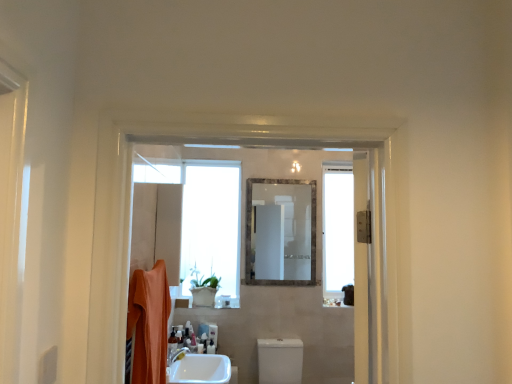
Where is `white glossy toilet at center`? The image size is (512, 384). white glossy toilet at center is located at coordinates (280, 360).

What is the approximate width of orange cotton bath towel at left?

The width of orange cotton bath towel at left is 4.02 inches.

Where is `translucent plastic bottle at lower center, placed as the 1th toiletry when sorted from top to bottom`? This screenshot has height=384, width=512. translucent plastic bottle at lower center, placed as the 1th toiletry when sorted from top to bottom is located at coordinates (172, 343).

This screenshot has height=384, width=512. What do you see at coordinates (176, 355) in the screenshot? I see `white glossy tap at lower center` at bounding box center [176, 355].

Image resolution: width=512 pixels, height=384 pixels. Describe the element at coordinates (281, 232) in the screenshot. I see `silver metallic mirror at center` at that location.

This screenshot has width=512, height=384. I want to click on translucent plastic soap dispenser at lower center, placed as the 1th toiletry when sorted from back to front, so click(211, 347).

Identify the location of transparent glass window at right. Image resolution: width=512 pixels, height=384 pixels. (338, 229).

Does translucent plastic soap dispenser at lower center, acting as the first toiletry starting from the right, have a greater height compared to orange cotton bath towel at left?

No.

What's the angular difference between translucent plastic soap dispenser at lower center, placed as the 1th toiletry when sorted from back to front, and orange cotton bath towel at left's facing directions?

There is a 91.3-degree angle between the facing directions of translucent plastic soap dispenser at lower center, placed as the 1th toiletry when sorted from back to front, and orange cotton bath towel at left.

In the scene shown: From the image's perspective, between translucent plastic soap dispenser at lower center, the 1th toiletry in the bottom-to-top sequence, and orange cotton bath towel at left, who is located below?

From the image's view, translucent plastic soap dispenser at lower center, the 1th toiletry in the bottom-to-top sequence, is below.

Is translucent plastic soap dispenser at lower center, acting as the first toiletry starting from the right, positioned far away from orange cotton bath towel at left?

Absolutely, translucent plastic soap dispenser at lower center, acting as the first toiletry starting from the right, is distant from orange cotton bath towel at left.

Does silver metallic mirror at center appear on the right side of orange cotton bath towel at left?

Indeed, silver metallic mirror at center is positioned on the right side of orange cotton bath towel at left.

From a real-world perspective, is silver metallic mirror at center positioned over orange cotton bath towel at left based on gravity?

Yes.

Is orange cotton bath towel at left inside silver metallic mirror at center?

Definitely not — orange cotton bath towel at left is not inside silver metallic mirror at center.

From the picture: From the image's perspective, who appears lower, silver metallic mirror at center or white glossy toilet at center?

white glossy toilet at center is shown below in the image.

Is point (252, 213) behind point (267, 377)?

Yes, it is.

Is silver metallic mirror at center located outside white glossy toilet at center?

silver metallic mirror at center lies outside white glossy toilet at center's area.

Is silver metallic mirror at center looking in the opposite direction of white glossy toilet at center?

No, silver metallic mirror at center's orientation is not away from white glossy toilet at center.

From the image's perspective, which object appears higher, silver metallic mirror at center or translucent plastic soap dispenser at lower center, the second toiletry in the front-to-back sequence?

From the image's view, silver metallic mirror at center is above.

Is point (305, 273) farther from camera compared to point (208, 348)?

Yes.

Between silver metallic mirror at center and translucent plastic soap dispenser at lower center, placed as the 1th toiletry when sorted from back to front, which one has larger size?

silver metallic mirror at center.

Which is correct: silver metallic mirror at center is inside translucent plastic soap dispenser at lower center, acting as the second toiletry starting from the left, or outside of it?

silver metallic mirror at center is outside translucent plastic soap dispenser at lower center, acting as the second toiletry starting from the left.

Are white glossy tap at lower center and translucent plastic soap dispenser at lower center, the second toiletry in the front-to-back sequence, beside each other?

No, white glossy tap at lower center is not in contact with translucent plastic soap dispenser at lower center, the second toiletry in the front-to-back sequence.

Between white glossy tap at lower center and translucent plastic soap dispenser at lower center, acting as the first toiletry starting from the right, which one has less height?

Standing shorter between the two is white glossy tap at lower center.

Considering the sizes of white glossy tap at lower center and translucent plastic soap dispenser at lower center, acting as the second toiletry starting from the left, in the image, is white glossy tap at lower center bigger or smaller than translucent plastic soap dispenser at lower center, acting as the second toiletry starting from the left,?

white glossy tap at lower center is bigger than translucent plastic soap dispenser at lower center, acting as the second toiletry starting from the left.

Is there a large distance between transparent glass window at right and silver metallic mirror at center?

No, transparent glass window at right is not far away from silver metallic mirror at center.

Can you confirm if transparent glass window at right is thinner than silver metallic mirror at center?

No, transparent glass window at right is not thinner than silver metallic mirror at center.

From the picture: Who is smaller, transparent glass window at right or silver metallic mirror at center?

silver metallic mirror at center.

Considering their positions, is transparent glass window at right located in front of or behind silver metallic mirror at center?

transparent glass window at right is positioned farther from the viewer than silver metallic mirror at center.

Is point (169, 346) closer or farther from the camera than point (311, 227)?

Clearly, point (169, 346) is closer to the camera than point (311, 227).

From the image's perspective, is translucent plastic bottle at lower center, which is counted as the 2th toiletry, starting from the back, positioned above or below silver metallic mirror at center?

translucent plastic bottle at lower center, which is counted as the 2th toiletry, starting from the back, is situated lower than silver metallic mirror at center in the image.

Which object is positioned more to the left, translucent plastic bottle at lower center, which is counted as the 2th toiletry, starting from the right, or silver metallic mirror at center?

translucent plastic bottle at lower center, which is counted as the 2th toiletry, starting from the right.

I want to click on bath towel in front of the translucent plastic soap dispenser at lower center, placed as the 1th toiletry when sorted from back to front, so click(149, 323).

Where is `bath towel on the left side of silver metallic mirror at center`? bath towel on the left side of silver metallic mirror at center is located at coordinates (149, 323).

Looking at the image, which one is located closer to translucent plastic bottle at lower center, placed as the 1th toiletry when sorted from top to bottom, translucent plastic soap dispenser at lower center, acting as the first toiletry starting from the right, or transparent glass window at right?

The object closer to translucent plastic bottle at lower center, placed as the 1th toiletry when sorted from top to bottom, is translucent plastic soap dispenser at lower center, acting as the first toiletry starting from the right.

Looking at this image, looking at the image, which one is located closer to transparent glass window at right, white glossy tap at lower center or translucent plastic soap dispenser at lower center, the second toiletry in the front-to-back sequence?

translucent plastic soap dispenser at lower center, the second toiletry in the front-to-back sequence, is closer to transparent glass window at right.

Looking at the image, which one is located further to orange cotton bath towel at left, white glossy tap at lower center or white glossy toilet at center?

Among the two, white glossy toilet at center is located further to orange cotton bath towel at left.

From the image, which object appears to be farther from silver metallic mirror at center, translucent plastic bottle at lower center, which appears as the first toiletry when viewed from the front, or white glossy tap at lower center?

white glossy tap at lower center is further to silver metallic mirror at center.

In the scene shown: Based on their spatial positions, is translucent plastic soap dispenser at lower center, acting as the second toiletry starting from the left, or translucent plastic bottle at lower center, which is the first toiletry in left-to-right order, further from silver metallic mirror at center?

translucent plastic bottle at lower center, which is the first toiletry in left-to-right order.

When comparing their distances from translucent plastic bottle at lower center, the second toiletry from the bottom, does white glossy tap at lower center or translucent plastic soap dispenser at lower center, which is the second toiletry in top-to-bottom order, seem closer?

Based on the image, white glossy tap at lower center appears to be nearer to translucent plastic bottle at lower center, the second toiletry from the bottom.

Which object lies nearer to the anchor point silver metallic mirror at center, transparent glass window at right or white glossy tap at lower center?

transparent glass window at right is closer to silver metallic mirror at center.

Estimate the real-world distances between objects in this image. Which object is closer to translucent plastic soap dispenser at lower center, placed as the 1th toiletry when sorted from back to front, silver metallic mirror at center or orange cotton bath towel at left?

silver metallic mirror at center.

In order to click on mirror between orange cotton bath towel at left and transparent glass window at right along the z-axis in this screenshot , I will do [x=281, y=232].

I want to click on toilet bowl situated between translucent plastic soap dispenser at lower center, the second toiletry in the front-to-back sequence, and transparent glass window at right from left to right, so click(x=280, y=360).

The width and height of the screenshot is (512, 384). What are the coordinates of `tap between silver metallic mirror at center and white glossy toilet at center from top to bottom` in the screenshot? It's located at (176, 355).

The image size is (512, 384). Find the location of `toiletry between white glossy tap at lower center and white glossy toilet at center in the horizontal direction`. toiletry between white glossy tap at lower center and white glossy toilet at center in the horizontal direction is located at coordinates (211, 347).